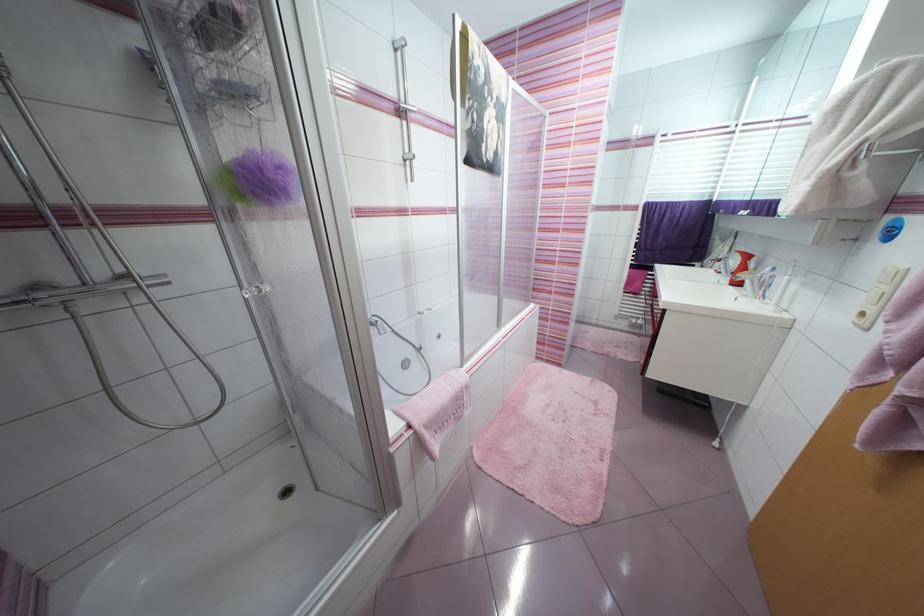
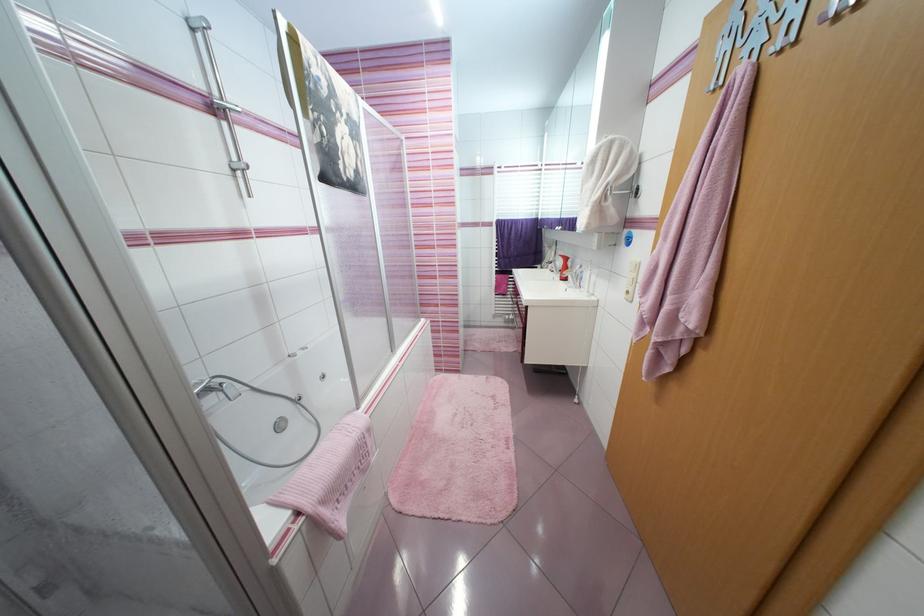
Find the pixel in the second image that matches point 412,164 in the first image.

(245, 175)